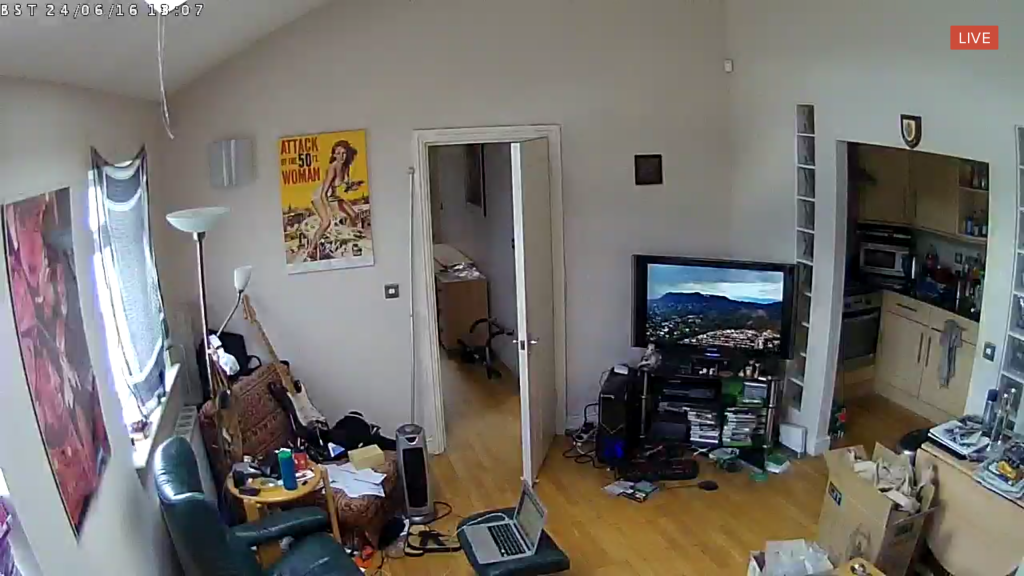
Identify the location of wooden floor. This screenshot has height=576, width=1024. (480, 420), (638, 529).